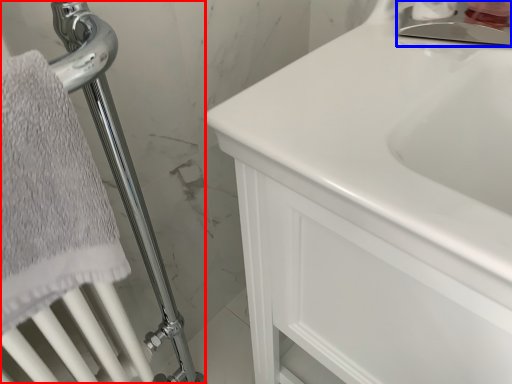
Question: Which object is closer to the camera taking this photo, shower (highlighted by a red box) or faucet (highlighted by a blue box)?

Choices:
 (A) shower
 (B) faucet

Answer: (A)